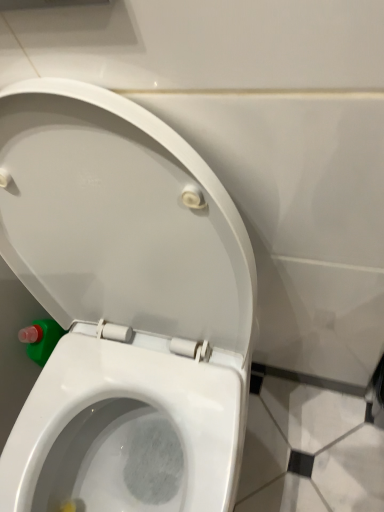
Locate an element on the screen. The width and height of the screenshot is (384, 512). white glossy toilet at center is located at coordinates (122, 298).

What do you see at coordinates (122, 298) in the screenshot? I see `white glossy toilet at center` at bounding box center [122, 298].

The height and width of the screenshot is (512, 384). I want to click on white glossy toilet at center, so 122,298.